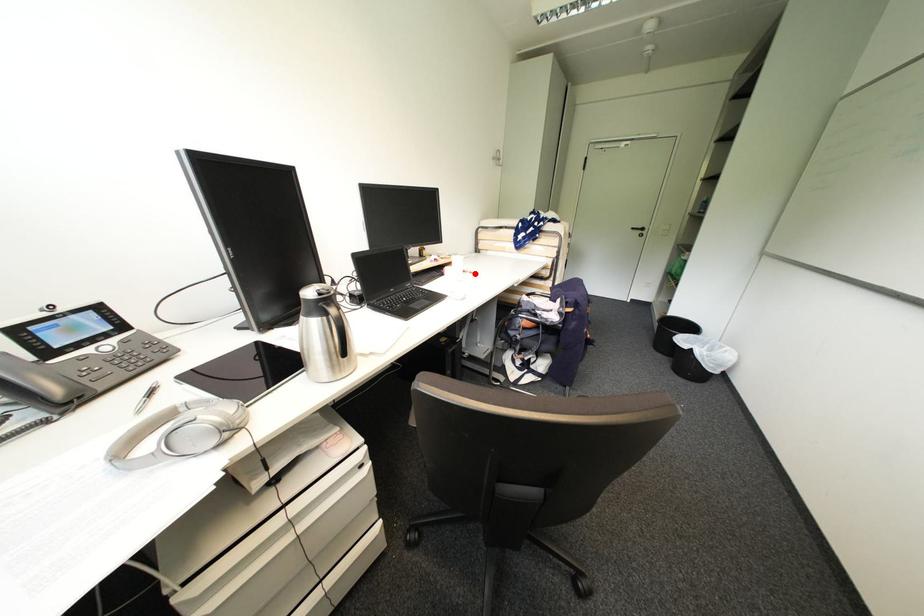
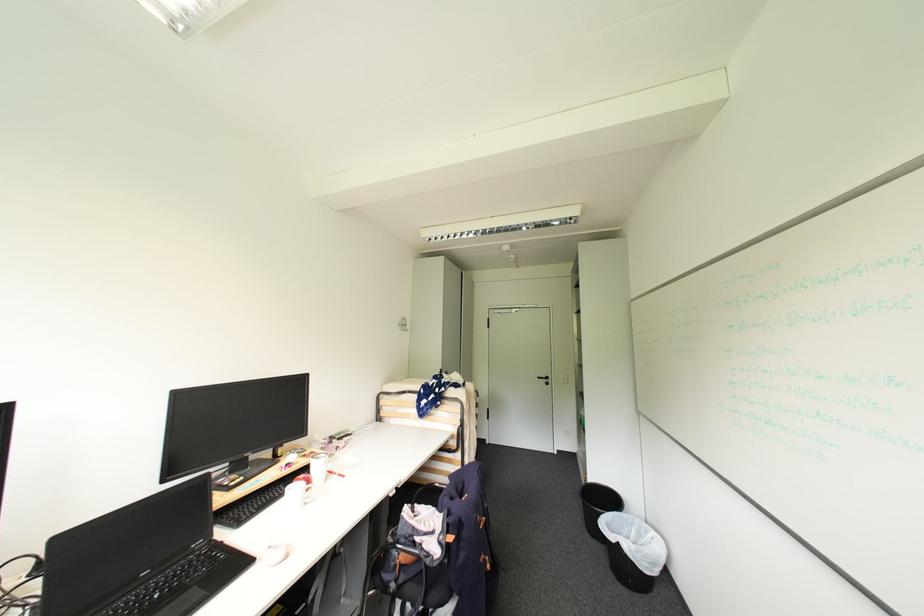
Locate, in the second image, the point that corresponds to the highlighted location in the first image.

(343, 477)